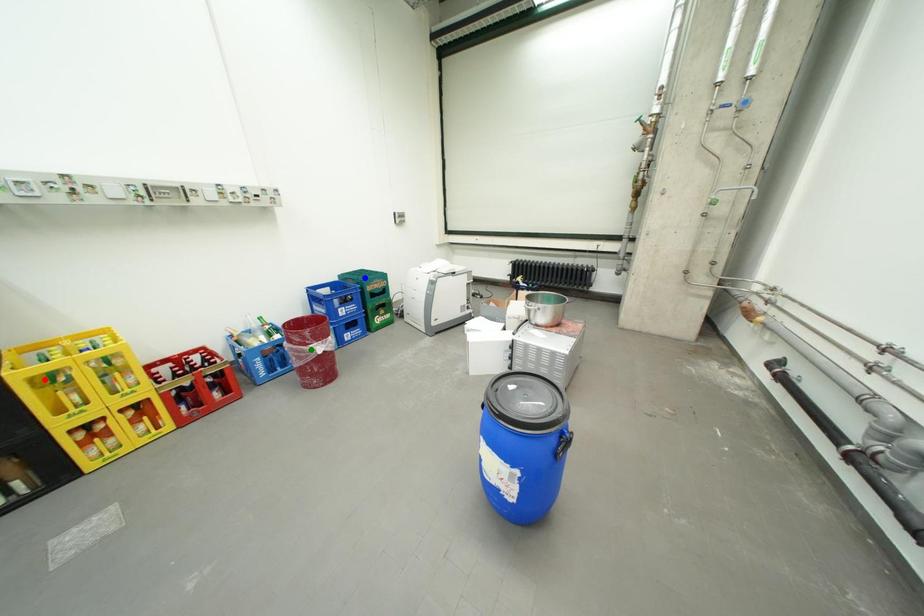
Order these from nearest to farthest:
green point
red point
blue point

blue point → green point → red point